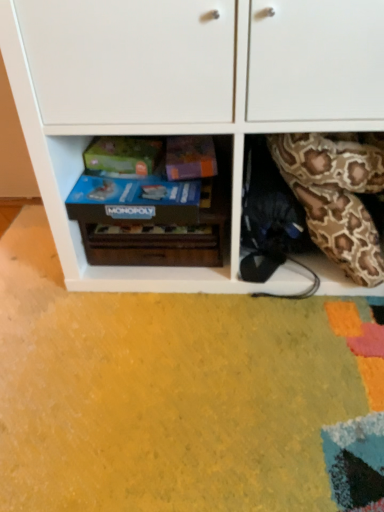
The image size is (384, 512). I want to click on free space in front of white matte cabinet at center, so click(215, 380).